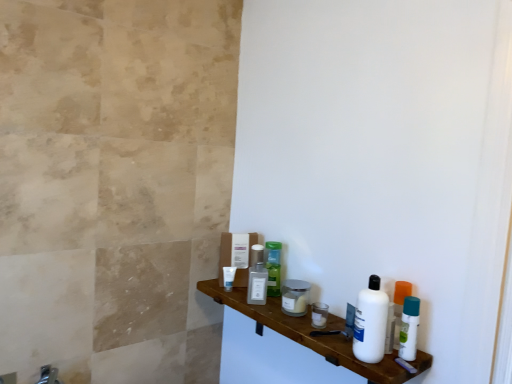
Question: Is white matte tube at center, which appears as the 1th toiletry when viewed from the left, wider than white plastic bottle at right, arranged as the 1th mouthwash when viewed from the front?

Choices:
 (A) no
 (B) yes

Answer: (A)

Question: Is the depth of white matte tube at center, acting as the 4th toiletry starting from the front, less than that of white plastic bottle at right, acting as the second mouthwash starting from the left?

Choices:
 (A) yes
 (B) no

Answer: (B)

Question: Is white matte tube at center, acting as the 4th toiletry starting from the front, further to the viewer compared to white plastic bottle at right, which appears as the second mouthwash when viewed from the back?

Choices:
 (A) yes
 (B) no

Answer: (A)

Question: Is white matte tube at center, which is the fourth toiletry in right-to-left order, not close to white plastic bottle at right, acting as the second mouthwash starting from the left?

Choices:
 (A) yes
 (B) no

Answer: (B)

Question: From a real-world perspective, is white matte tube at center, the 1th toiletry viewed from the back, beneath white plastic bottle at right, arranged as the 1th mouthwash when viewed from the front?

Choices:
 (A) yes
 (B) no

Answer: (A)

Question: Is metallic silver jar at center, marked as the 1th toiletry in a front-to-back arrangement, inside the boundaries of white plastic bottle at right, or outside?

Choices:
 (A) outside
 (B) inside

Answer: (A)

Question: From a real-world perspective, is metallic silver jar at center, which ranks as the fourth toiletry in left-to-right order, positioned above or below white plastic bottle at right?

Choices:
 (A) below
 (B) above

Answer: (A)

Question: From the image's perspective, relative to white plastic bottle at right, is metallic silver jar at center, marked as the 1th toiletry in a front-to-back arrangement, above or below?

Choices:
 (A) above
 (B) below

Answer: (B)

Question: Considering the positions of metallic silver jar at center, which ranks as the fourth toiletry in left-to-right order, and white plastic bottle at right in the image, is metallic silver jar at center, which ranks as the fourth toiletry in left-to-right order, taller or shorter than white plastic bottle at right?

Choices:
 (A) short
 (B) tall

Answer: (A)

Question: From the image's perspective, is green plastic bottle at center, acting as the 2th toiletry starting from the back, above or below white plastic bottle at right, which appears as the second mouthwash when viewed from the back?

Choices:
 (A) below
 (B) above

Answer: (B)

Question: In terms of height, does green plastic bottle at center, acting as the 2th toiletry starting from the back, look taller or shorter compared to white plastic bottle at right, arranged as the 1th mouthwash when viewed from the front?

Choices:
 (A) short
 (B) tall

Answer: (B)

Question: Considering the positions of point (275, 273) and point (406, 340), is point (275, 273) closer or farther from the camera than point (406, 340)?

Choices:
 (A) farther
 (B) closer

Answer: (A)

Question: Is green plastic bottle at center, which ranks as the third toiletry in front-to-back order, spatially inside white plastic bottle at right, acting as the second mouthwash starting from the left, or outside of it?

Choices:
 (A) inside
 (B) outside

Answer: (B)

Question: Relative to satin silver mouthwash at center, which is the second mouthwash in right-to-left order, is brushed metal faucet at lower left in front or behind?

Choices:
 (A) behind
 (B) front

Answer: (B)

Question: Which is correct: brushed metal faucet at lower left is inside satin silver mouthwash at center, the first mouthwash from the back, or outside of it?

Choices:
 (A) inside
 (B) outside

Answer: (B)